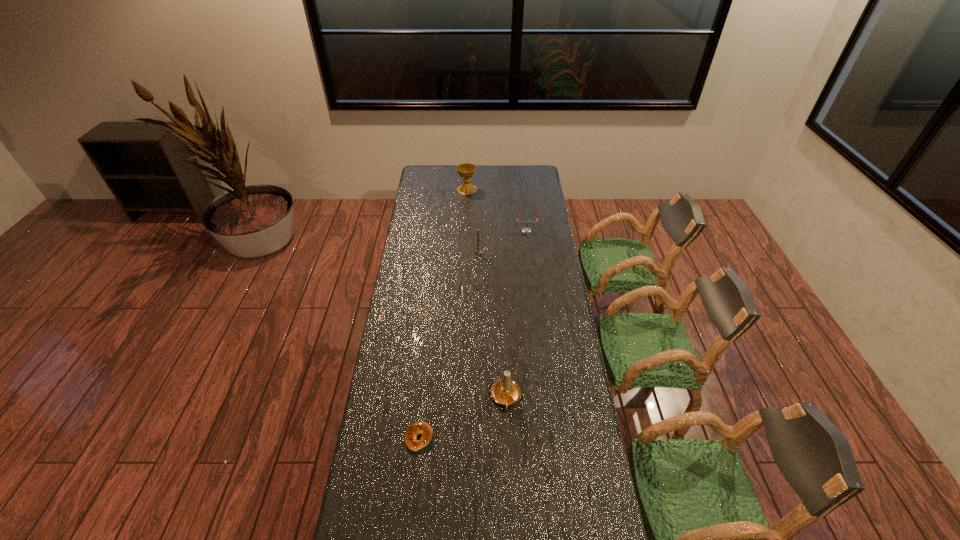
Locate an element on the screen. Image resolution: width=960 pixels, height=540 pixels. chalice is located at coordinates (466, 170).

What are the coordinates of `the nearest candle` in the screenshot? It's located at (506, 392).

What are the coordinates of `the fourth farthest object` in the screenshot? It's located at (506, 392).

At what (x,y) coordinates should I click in order to perform the action: click on the leftmost candle. Please return your answer as a coordinate pair (x, y). The width and height of the screenshot is (960, 540). Looking at the image, I should click on (478, 251).

At what (x,y) coordinates should I click in order to perform the action: click on the third farthest object. Please return your answer as a coordinate pair (x, y). This screenshot has width=960, height=540. Looking at the image, I should click on (478, 251).

Locate an element on the screen. This screenshot has width=960, height=540. the second shortest object is located at coordinates (526, 230).

This screenshot has height=540, width=960. Identify the location of the second farthest object. (526, 230).

This screenshot has width=960, height=540. I want to click on the shortest object, so click(x=415, y=429).

Locate an element on the screen. The image size is (960, 540). the leftmost object is located at coordinates (415, 429).

Where is `blank space located on the left of the chalice`? The image size is (960, 540). blank space located on the left of the chalice is located at coordinates (433, 190).